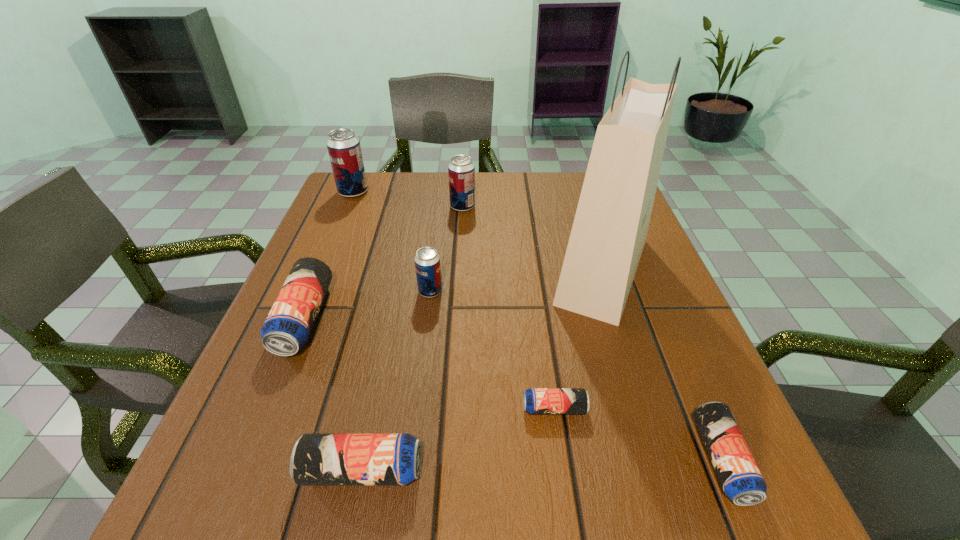
Identify the location of blank space located 0.050m on the left of the second blue beer can from left to right. (268, 470).

Find the location of `free spot located on the left of the second shortest object`. free spot located on the left of the second shortest object is located at coordinates 557,460.

Where is `vacant region located on the front of the third blue beer can from left to right`? The width and height of the screenshot is (960, 540). vacant region located on the front of the third blue beer can from left to right is located at coordinates (568, 508).

Locate an element on the screen. Image resolution: width=960 pixels, height=540 pixels. shopping bag that is at the right edge is located at coordinates (610, 227).

Find the location of a particular element. The height and width of the screenshot is (540, 960). beer can that is at the right edge is located at coordinates (741, 480).

You are a GUI agent. You are given a task and a screenshot of the screen. Output one action in this format:
    pyautogui.click(x=<x>, y=<y>)
    Task: Click on the object located at the far left corner
    
    Given the screenshot: What is the action you would take?
    pyautogui.click(x=344, y=149)

At what (x,y) coordinates should I click in order to perform the action: click on object situated at the near left corner. Please return your answer as a coordinate pair (x, y). Looking at the image, I should click on (317, 459).

The height and width of the screenshot is (540, 960). What are the coordinates of `object that is at the near right corner` in the screenshot? It's located at 741,480.

This screenshot has width=960, height=540. Identify the location of vacant region at the far edge of the desktop. (x=532, y=172).

The image size is (960, 540). What are the coordinates of `free point at the left edge` in the screenshot? It's located at (348, 232).